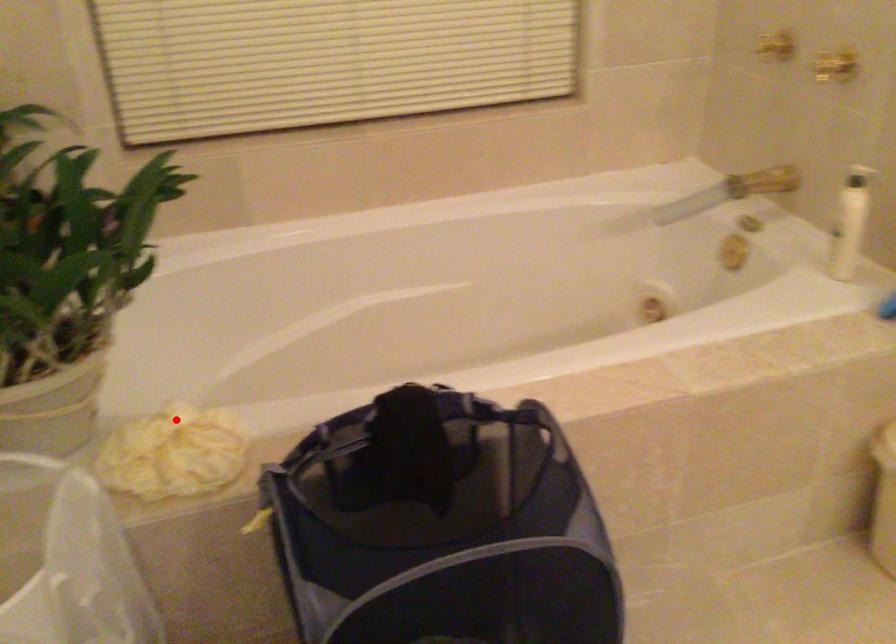
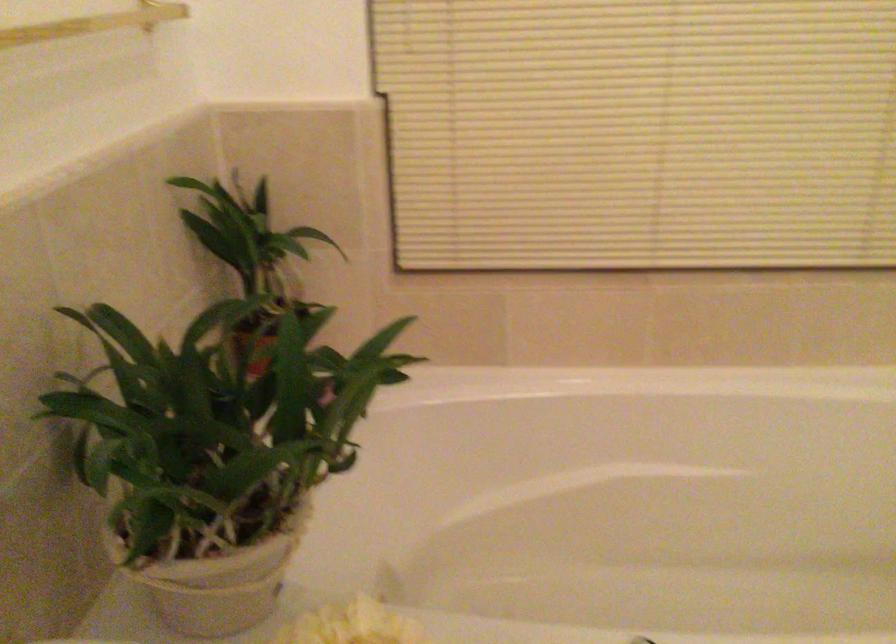
The point at the highlighted location is marked in the first image. Where is the corresponding point in the second image?

(351, 625)